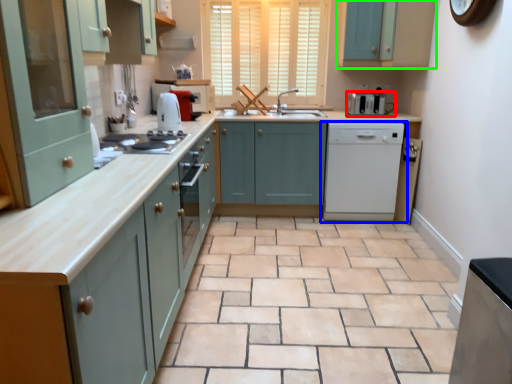
Question: Which object is positioned farthest from home appliance (highlighted by a red box)? Select from home appliance (highlighted by a blue box) and cabinetry (highlighted by a green box).

Choices:
 (A) home appliance
 (B) cabinetry

Answer: (B)